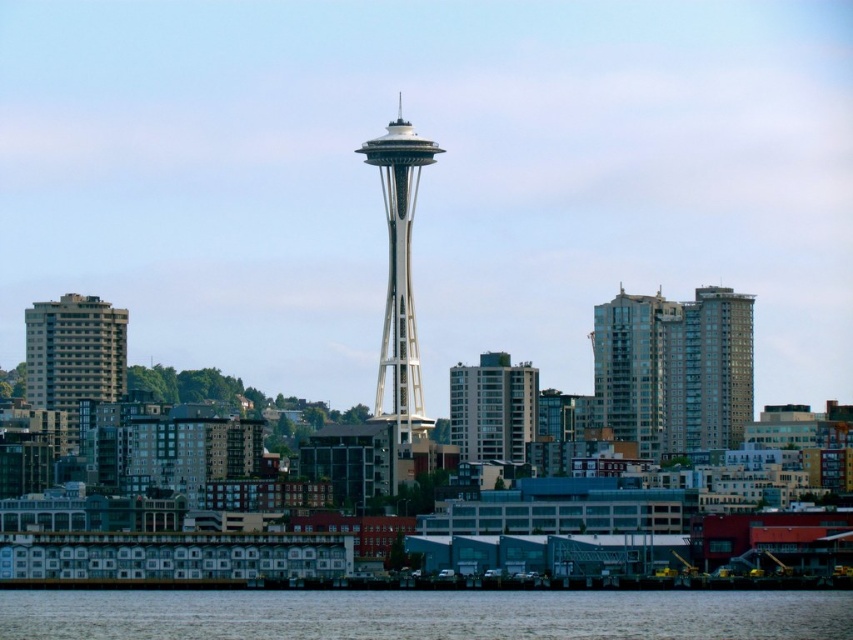
Question: From the image, what is the correct spatial relationship of gray concrete building at left in relation to matte glass building at center?

Choices:
 (A) right
 (B) left

Answer: (B)

Question: Does gray concrete building at left appear on the left side of matte glass building at center?

Choices:
 (A) no
 (B) yes

Answer: (B)

Question: Which object is positioned closest to the transparent water at lower center?

Choices:
 (A) matte glass building at center
 (B) white metallic space needle at center

Answer: (A)

Question: Does transparent water at lower center appear on the left side of glassy gray skyscraper at center-right?

Choices:
 (A) yes
 (B) no

Answer: (A)

Question: Which object is farther from the camera taking this photo?

Choices:
 (A) matte glass building at center
 (B) white metallic space needle at center
 (C) glassy gray skyscraper at center-right

Answer: (C)

Question: Which point is closer to the camera?

Choices:
 (A) matte glass building at center
 (B) white metallic space needle at center
 (C) transparent water at lower center

Answer: (B)